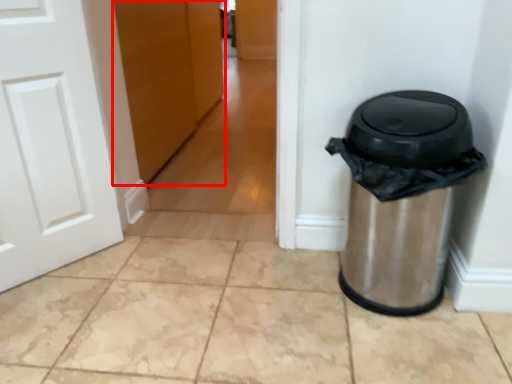
Question: Where is door (annotated by the red box) located in relation to waste container in the image?

Choices:
 (A) right
 (B) left

Answer: (B)